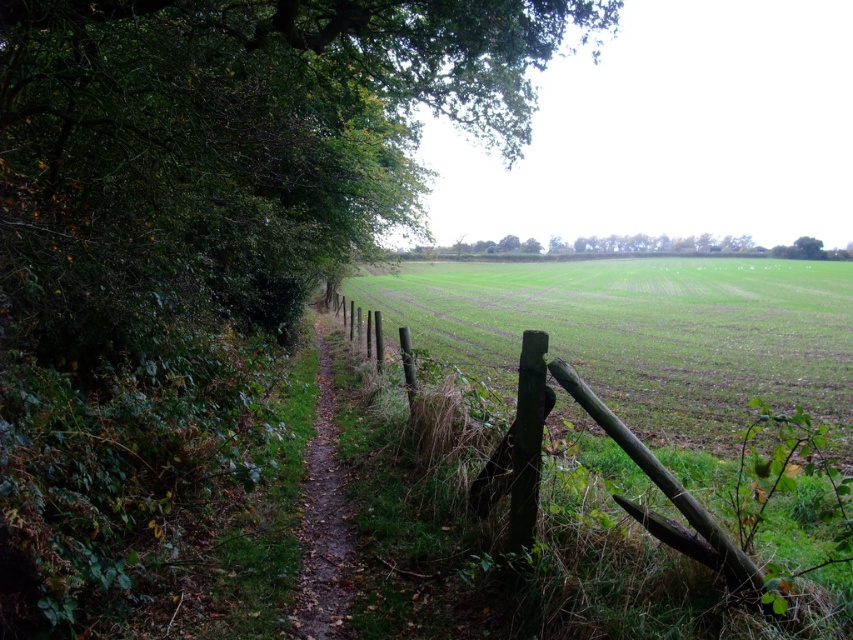
Question: Can you confirm if green grassy field at center is thinner than brown dirt path at center?

Choices:
 (A) yes
 (B) no

Answer: (B)

Question: Does green leafy tree at upper left come in front of brown dirt path at center?

Choices:
 (A) no
 (B) yes

Answer: (B)

Question: Among these objects, which one is farthest from the camera?

Choices:
 (A) green grassy field at center
 (B) weathered wood fence at center
 (C) green leafy tree at center

Answer: (C)

Question: Is the position of green leafy tree at upper left more distant than that of green leafy tree at center?

Choices:
 (A) yes
 (B) no

Answer: (B)

Question: Which point is farther from the camera taking this photo?

Choices:
 (A) (537, 243)
 (B) (498, 289)
 (C) (199, 124)
 (D) (323, 486)

Answer: (A)

Question: Which object appears closest to the camera in this image?

Choices:
 (A) weathered wood fence at center
 (B) brown dirt path at center
 (C) green leafy tree at center
 (D) green grassy field at center

Answer: (A)